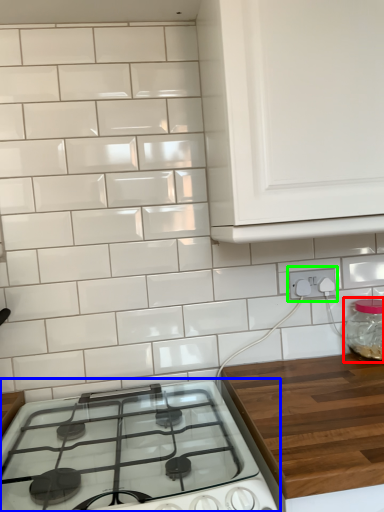
Question: Estimate the real-world distances between objects in this image. Which object is farther from glass jar (highlighted by a red box), gas stove (highlighted by a blue box) or electric outlet (highlighted by a green box)?

Choices:
 (A) gas stove
 (B) electric outlet

Answer: (A)